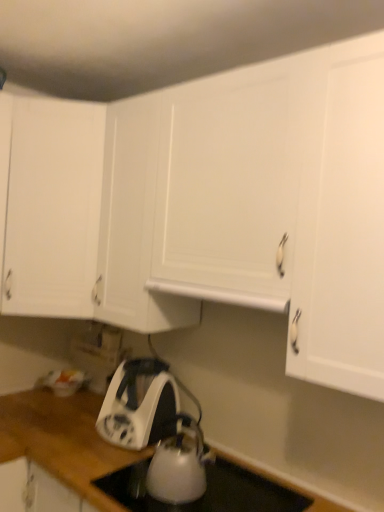
Image resolution: width=384 pixels, height=512 pixels. Identify the location of free point below white matte exhaust hood at center (from a real-world perspective). (250, 480).